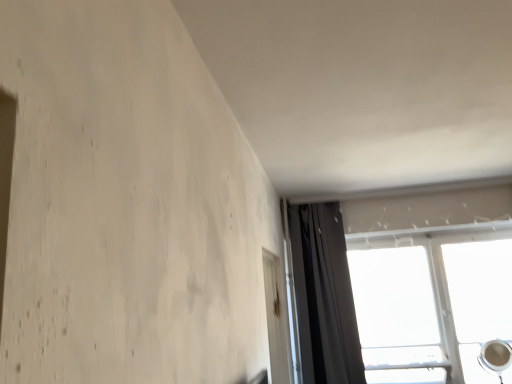
This screenshot has width=512, height=384. Identify the location of transparent plastic screen door at lower right. (276, 321).

Describe the element at coordinates (422, 205) in the screenshot. I see `transparent glass window at upper right` at that location.

What is the approximate height of transparent glass window at upper right?

The height of transparent glass window at upper right is 1.17 meters.

This screenshot has height=384, width=512. What are the coordinates of `transparent plastic screen door at lower right` in the screenshot? It's located at (276, 321).

Considering the sizes of dark gray fabric curtain at upper right and transparent plastic screen door at lower right in the image, is dark gray fabric curtain at upper right wider or thinner than transparent plastic screen door at lower right?

In the image, dark gray fabric curtain at upper right appears to be wider than transparent plastic screen door at lower right.

Does dark gray fabric curtain at upper right come behind transparent plastic screen door at lower right?

Yes.

From a real-world perspective, which object stands above the other?

In real-world perspective, dark gray fabric curtain at upper right is above.

Between dark gray fabric curtain at upper right and transparent plastic screen door at lower right, which one appears on the left side from the viewer's perspective?

transparent plastic screen door at lower right is more to the left.

In the scene shown: Which of these two, transparent glass window at upper right or transparent plastic screen door at lower right, is wider?

With larger width is transparent glass window at upper right.

What's the angular difference between transparent glass window at upper right and transparent plastic screen door at lower right's facing directions?

91.6 degrees separate the facing orientations of transparent glass window at upper right and transparent plastic screen door at lower right.

Would you say transparent glass window at upper right is outside transparent plastic screen door at lower right?

Yes, transparent glass window at upper right is not within transparent plastic screen door at lower right.

Does transparent glass window at upper right appear on the right side of transparent plastic screen door at lower right?

Yes.

From the image's perspective, which is above, transparent glass window at upper right or dark gray fabric curtain at upper right?

dark gray fabric curtain at upper right.

From a real-world perspective, which object rests below the other?

transparent glass window at upper right, from a real-world perspective.

Is transparent glass window at upper right facing towards dark gray fabric curtain at upper right?

Yes.

In the scene shown: Between transparent glass window at upper right and dark gray fabric curtain at upper right, which one has more height?

dark gray fabric curtain at upper right.

Can you confirm if dark gray fabric curtain at upper right is taller than transparent glass window at upper right?

Yes.

Is point (319, 305) positioned behind point (354, 219)?

That is False.

Is dark gray fabric curtain at upper right beside transparent glass window at upper right?

No, dark gray fabric curtain at upper right is not making contact with transparent glass window at upper right.

Considering the relative sizes of dark gray fabric curtain at upper right and transparent glass window at upper right in the image provided, is dark gray fabric curtain at upper right thinner than transparent glass window at upper right?

No.

Considering the sizes of objects transparent plastic screen door at lower right and dark gray fabric curtain at upper right in the image provided, who is smaller, transparent plastic screen door at lower right or dark gray fabric curtain at upper right?

Smaller between the two is transparent plastic screen door at lower right.

Is transparent plastic screen door at lower right looking in the opposite direction of dark gray fabric curtain at upper right?

That's not correct — transparent plastic screen door at lower right is not looking away from dark gray fabric curtain at upper right.

Which object is positioned more to the right, transparent plastic screen door at lower right or dark gray fabric curtain at upper right?

Positioned to the right is dark gray fabric curtain at upper right.

Image resolution: width=512 pixels, height=384 pixels. What are the coordinates of `window that appears behind the transparent plastic screen door at lower right` in the screenshot? It's located at (422, 205).

From the image's perspective, which is above, transparent plastic screen door at lower right or transparent glass window at upper right?

A: transparent plastic screen door at lower right, from the image's perspective.

Would you say transparent glass window at upper right is part of transparent plastic screen door at lower right's contents?

That's incorrect, transparent glass window at upper right is not inside transparent plastic screen door at lower right.

Is transparent plastic screen door at lower right thinner than transparent glass window at upper right?

Yes, transparent plastic screen door at lower right is thinner than transparent glass window at upper right.

Image resolution: width=512 pixels, height=384 pixels. I want to click on screen door on the left of dark gray fabric curtain at upper right, so click(x=276, y=321).

I want to click on window beneath the transparent plastic screen door at lower right (from a real-world perspective), so click(422, 205).

Considering their positions, is transparent glass window at upper right positioned further to dark gray fabric curtain at upper right than transparent plastic screen door at lower right?

transparent glass window at upper right is further to dark gray fabric curtain at upper right.

Which object lies nearer to the anchor point transparent glass window at upper right, transparent plastic screen door at lower right or dark gray fabric curtain at upper right?

dark gray fabric curtain at upper right.

In the scene shown: From the image, which object appears to be farther from dark gray fabric curtain at upper right, transparent plastic screen door at lower right or transparent glass window at upper right?

transparent glass window at upper right is positioned further to the anchor dark gray fabric curtain at upper right.

From the image, which object appears to be farther from transparent plastic screen door at lower right, dark gray fabric curtain at upper right or transparent glass window at upper right?

Among the two, transparent glass window at upper right is located further to transparent plastic screen door at lower right.

When comparing their distances from transparent plastic screen door at lower right, does transparent glass window at upper right or dark gray fabric curtain at upper right seem further?

Based on the image, transparent glass window at upper right appears to be further to transparent plastic screen door at lower right.

Based on their spatial positions, is dark gray fabric curtain at upper right or transparent plastic screen door at lower right closer to transparent glass window at upper right?

Among the two, dark gray fabric curtain at upper right is located nearer to transparent glass window at upper right.

Identify the location of curtain situated between transparent plastic screen door at lower right and transparent glass window at upper right from left to right. The width and height of the screenshot is (512, 384). (324, 296).